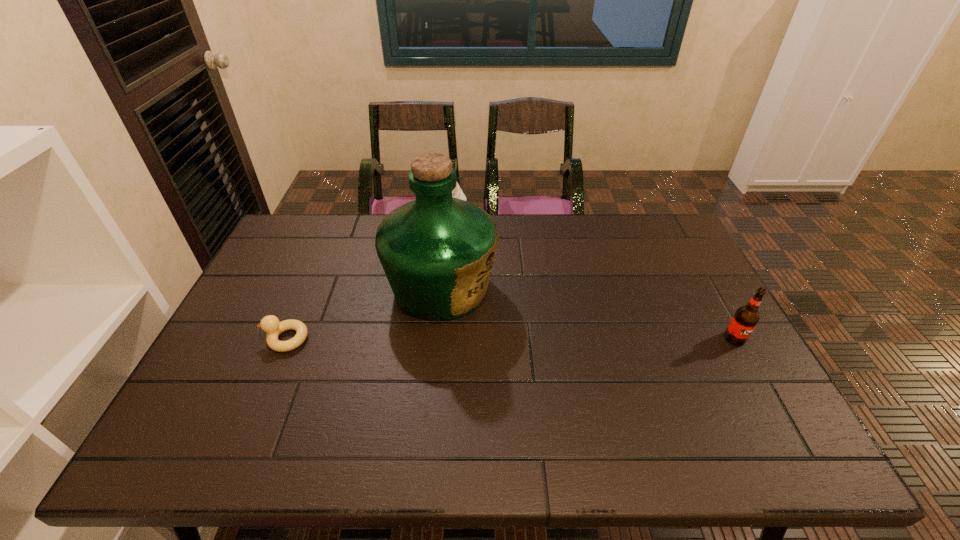
Locate an element on the screen. free spot located on the label side of the liquor is located at coordinates (594, 363).

This screenshot has height=540, width=960. In order to click on vacant space located on the label side of the liquor in this screenshot , I will do `click(606, 369)`.

What are the coordinates of `vacant region located on the label side of the liquor` in the screenshot? It's located at (533, 333).

The height and width of the screenshot is (540, 960). I want to click on icecream that is at the far edge, so click(x=457, y=192).

Where is `liquor that is at the far edge`? The image size is (960, 540). liquor that is at the far edge is located at coordinates (437, 252).

Find the location of a particular element. The width and height of the screenshot is (960, 540). object situated at the left edge is located at coordinates (270, 324).

Identify the location of object that is at the right edge. The height and width of the screenshot is (540, 960). (745, 319).

Image resolution: width=960 pixels, height=540 pixels. In order to click on vacant space at the far edge of the desktop in this screenshot , I will do `click(349, 240)`.

Locate an element on the screen. vacant space at the near edge of the desktop is located at coordinates (268, 406).

Image resolution: width=960 pixels, height=540 pixels. Find the location of `vacant space at the left edge of the desktop`. vacant space at the left edge of the desktop is located at coordinates (293, 281).